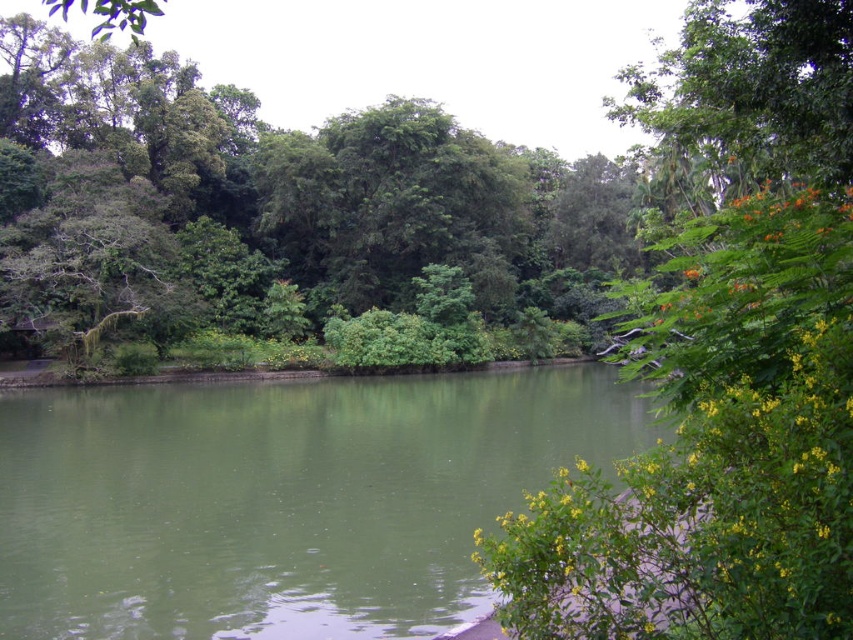
You are standing at the edge of the pond and want to cross to the other side. The green smooth water at center is where you need to step on. Considering the width of the green leafy trees at upper center, do you think the water is wide enough to cross?

The green smooth water at center has a lesser width compared to green leafy trees at upper center, so the water is narrower than the trees. Since the water is narrower, it might be possible to cross it, but you should check the actual distance before attempting to step.

You are standing at the edge of the water in the scene. There is a point marked at coordinates point (281, 499). What does this point represent?

The point (281, 499) represents the green smooth water at center.